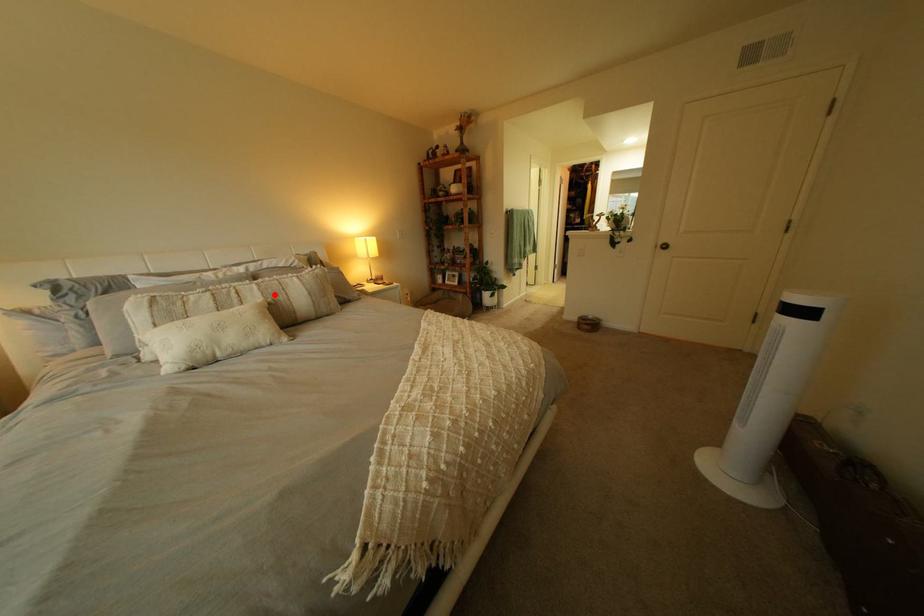
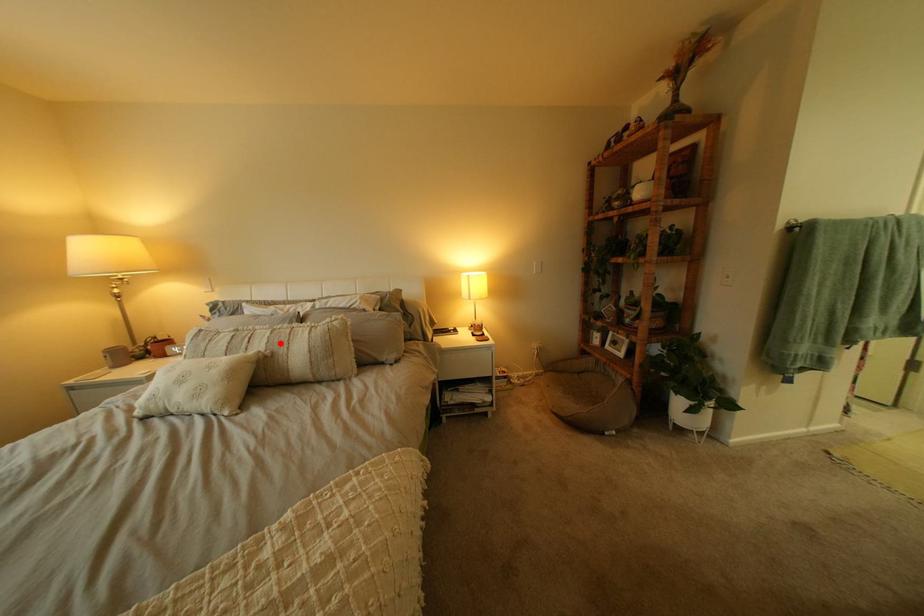
I am providing you with two images of the same scene from different viewpoints. A red point is marked on the first image and another point is marked on the second image. Do the highlighted points in image1 and image2 indicate the same real-world spot?

Yes